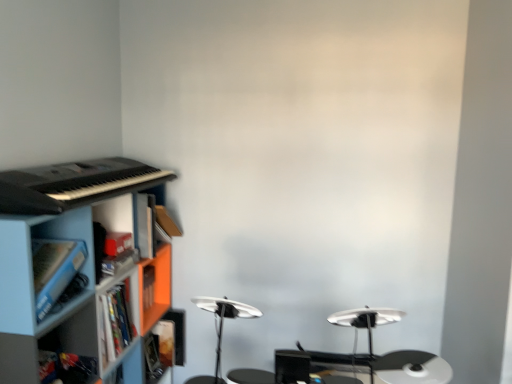
Question: Is hardcover book at lower left taller or shorter than blue plastic cabinet at lower left, which is the second cabinet from back to front?

Choices:
 (A) short
 (B) tall

Answer: (B)

Question: Is hardcover book at lower left wider or thinner than blue plastic cabinet at lower left, which is the second cabinet from back to front?

Choices:
 (A) thin
 (B) wide

Answer: (A)

Question: Estimate the real-world distances between objects in this image. Which object is closer to the orange matte cabinet at left, the 2th cabinet when ordered from front to back?

Choices:
 (A) blue plastic shelf at lower left
 (B) hardcover book at lower left
 (C) blue plastic cabinet at lower left, which is the second cabinet from back to front

Answer: (A)

Question: Based on their relative distances, which object is nearer to the blue plastic cabinet at lower left, which is the second cabinet from back to front?

Choices:
 (A) orange matte cabinet at left, the 2th cabinet when ordered from front to back
 (B) blue plastic shelf at lower left
 (C) hardcover book at lower left

Answer: (B)